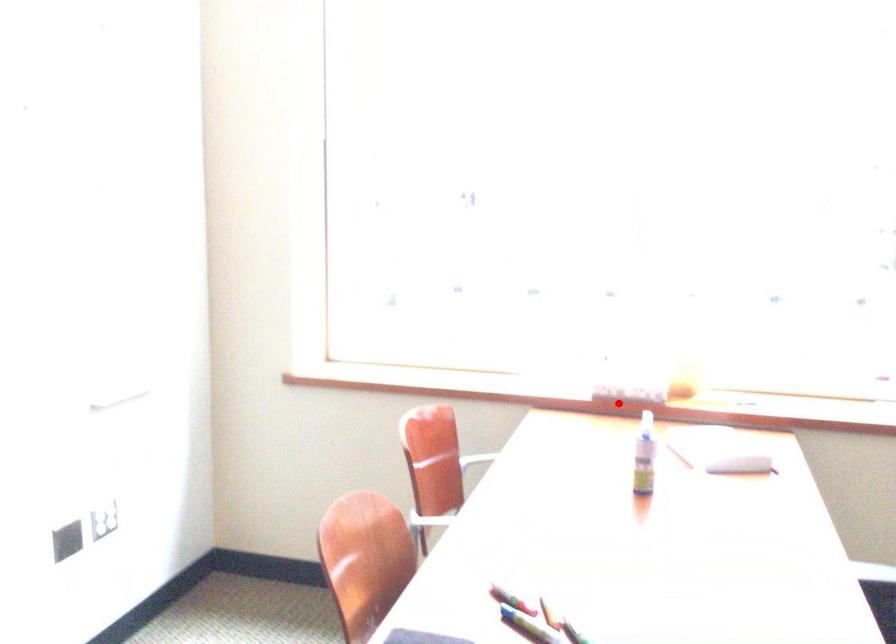
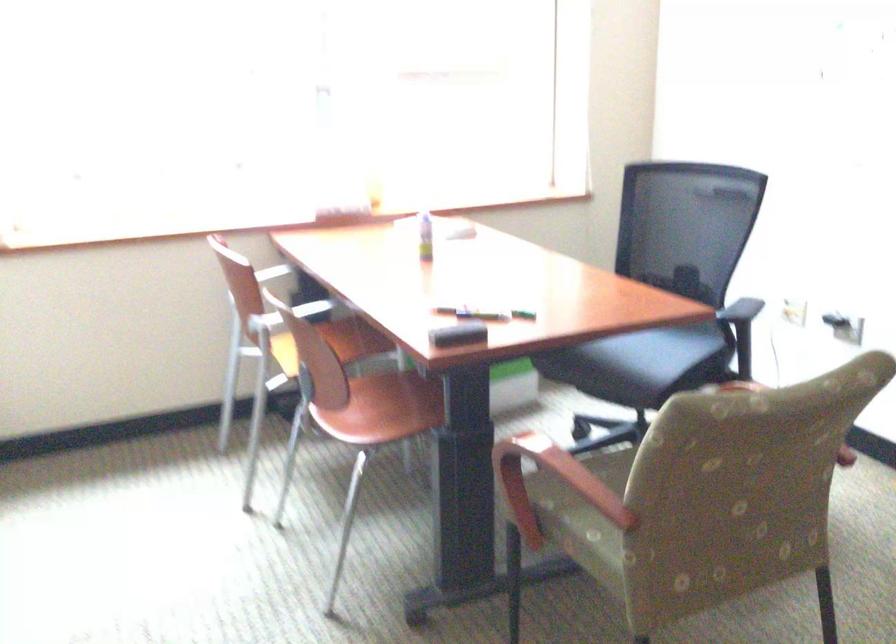
Question: I am providing you with two images of the same scene from different viewpoints. In image1, a red point is highlighted. Considering the same 3D point in image2, which of the following is correct?

Choices:
 (A) It is closer
 (B) It is farther

Answer: (B)